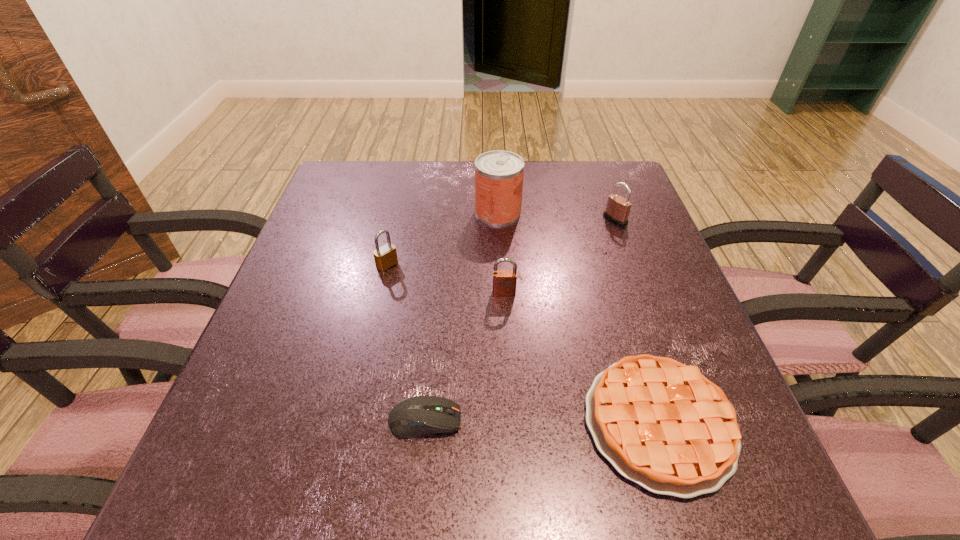
This screenshot has height=540, width=960. What are the coordinates of `vacant space in between the farthest padlock and the fifth object from right to left` in the screenshot? It's located at (520, 320).

Find the location of a particular element. The height and width of the screenshot is (540, 960). vacant area that lies between the pie and the computer equipment is located at coordinates (541, 421).

This screenshot has width=960, height=540. In order to click on free point between the tallest object and the farthest padlock in this screenshot , I will do `click(557, 216)`.

I want to click on vacant area between the pie and the tallest object, so click(x=578, y=318).

The width and height of the screenshot is (960, 540). Find the location of `vacant space that's between the leftmost padlock and the computer equipment`. vacant space that's between the leftmost padlock and the computer equipment is located at coordinates (406, 342).

The image size is (960, 540). Identify the location of empty space that is in between the fifth object from right to left and the pie. (541, 421).

Where is `empty space between the second farthest padlock and the fourth farthest object`? Image resolution: width=960 pixels, height=540 pixels. empty space between the second farthest padlock and the fourth farthest object is located at coordinates (445, 279).

Identify which object is the fourth closest to the tallest object. Please provide its 2D coordinates. Your answer should be formatted as a tuple, i.e. [(x, y)], where the tuple contains the x and y coordinates of a point satisfying the conditions above.

[(663, 425)]

The image size is (960, 540). I want to click on object that is the fifth closest to the pie, so click(385, 256).

Point out which padlock is positioned as the second nearest to the second object from left to right. Please provide its 2D coordinates. Your answer should be formatted as a tuple, i.e. [(x, y)], where the tuple contains the x and y coordinates of a point satisfying the conditions above.

[(385, 256)]